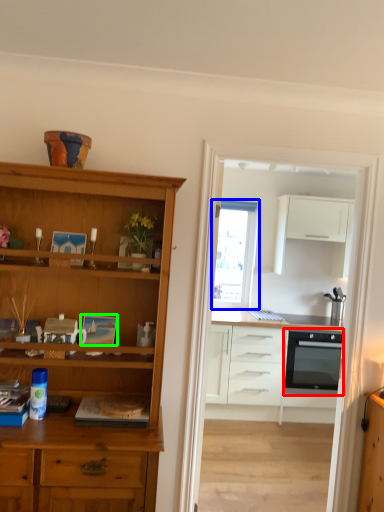
Question: Based on their relative distances, which object is farther from oven (highlighted by a red box)? Choose from window (highlighted by a blue box) and picture frame (highlighted by a green box).

Choices:
 (A) window
 (B) picture frame

Answer: (B)